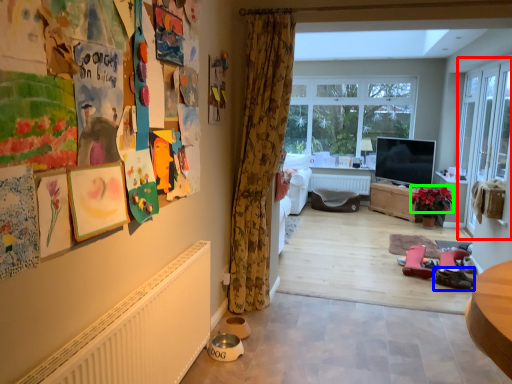
Question: Considering the real-world distances, which object is closest to screen door (highlighted by a red box)? footwear (highlighted by a blue box) or flower (highlighted by a green box).

Choices:
 (A) footwear
 (B) flower

Answer: (B)